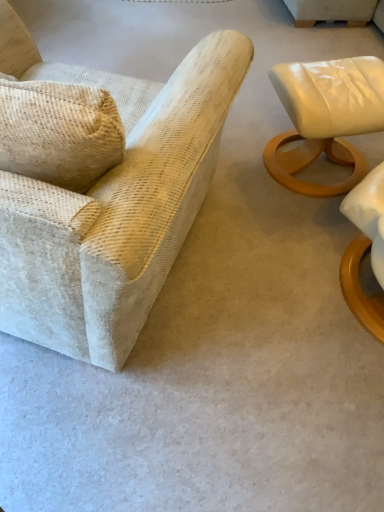
The height and width of the screenshot is (512, 384). What do you see at coordinates (325, 118) in the screenshot?
I see `matte white leather ottoman at right, the second chair viewed from the left` at bounding box center [325, 118].

Identify the location of matte white leather ottoman at right, positioned as the 1th chair in right-to-left order. (325, 118).

Find the location of a particular element. The image size is (384, 512). textured beige armchair at left, which appears as the second chair when viewed from the right is located at coordinates (112, 203).

What do you see at coordinates (112, 203) in the screenshot?
I see `textured beige armchair at left, arranged as the 1th chair when viewed from the left` at bounding box center [112, 203].

Where is `matte white leather ottoman at right, the second chair viewed from the left`? The height and width of the screenshot is (512, 384). matte white leather ottoman at right, the second chair viewed from the left is located at coordinates (325, 118).

Between matte white leather ottoman at right, the second chair viewed from the left, and textured beige armchair at left, which appears as the second chair when viewed from the right, which one appears on the right side from the viewer's perspective?

matte white leather ottoman at right, the second chair viewed from the left.

Is matte white leather ottoman at right, positioned as the 1th chair in right-to-left order, positioned behind textured beige armchair at left, which appears as the second chair when viewed from the right?

Yes.

Considering the positions of point (290, 109) and point (164, 118), is point (290, 109) closer or farther from the camera than point (164, 118)?

Point (290, 109) is farther from the camera than point (164, 118).

Based on the photo, from the image's perspective, would you say matte white leather ottoman at right, the second chair viewed from the left, is positioned over textured beige armchair at left, arranged as the 1th chair when viewed from the left?

Correct, matte white leather ottoman at right, the second chair viewed from the left, appears higher than textured beige armchair at left, arranged as the 1th chair when viewed from the left, in the image.

Looking at this image, from a real-world perspective, between matte white leather ottoman at right, the second chair viewed from the left, and textured beige armchair at left, which appears as the second chair when viewed from the right, who is vertically lower?

In real-world perspective, matte white leather ottoman at right, the second chair viewed from the left, is lower.

Between matte white leather ottoman at right, the second chair viewed from the left, and textured beige armchair at left, arranged as the 1th chair when viewed from the left, which one has smaller width?

matte white leather ottoman at right, the second chair viewed from the left.

Who is taller, matte white leather ottoman at right, positioned as the 1th chair in right-to-left order, or textured beige armchair at left, which appears as the second chair when viewed from the right?

textured beige armchair at left, which appears as the second chair when viewed from the right.

Between matte white leather ottoman at right, positioned as the 1th chair in right-to-left order, and textured beige armchair at left, which appears as the second chair when viewed from the right, which one has larger size?

With larger size is textured beige armchair at left, which appears as the second chair when viewed from the right.

Looking at this image, would you say matte white leather ottoman at right, positioned as the 1th chair in right-to-left order, is inside or outside textured beige armchair at left, arranged as the 1th chair when viewed from the left?

matte white leather ottoman at right, positioned as the 1th chair in right-to-left order, is located beyond the bounds of textured beige armchair at left, arranged as the 1th chair when viewed from the left.

Is matte white leather ottoman at right, the second chair viewed from the left, placed right next to textured beige armchair at left, which appears as the second chair when viewed from the right?

They are not placed beside each other.

Based on the photo, is matte white leather ottoman at right, positioned as the 1th chair in right-to-left order, facing towards textured beige armchair at left, which appears as the second chair when viewed from the right?

No.

How distant is matte white leather ottoman at right, the second chair viewed from the left, from textured beige armchair at left, arranged as the 1th chair when viewed from the left?

A distance of 29.43 inches exists between matte white leather ottoman at right, the second chair viewed from the left, and textured beige armchair at left, arranged as the 1th chair when viewed from the left.

The image size is (384, 512). I want to click on chair on the right of textured beige armchair at left, which appears as the second chair when viewed from the right, so click(x=325, y=118).

In the scene shown: Which object is positioned more to the left, textured beige armchair at left, which appears as the second chair when viewed from the right, or matte white leather ottoman at right, positioned as the 1th chair in right-to-left order?

From the viewer's perspective, textured beige armchair at left, which appears as the second chair when viewed from the right, appears more on the left side.

Looking at this image, considering the positions of objects textured beige armchair at left, which appears as the second chair when viewed from the right, and matte white leather ottoman at right, the second chair viewed from the left, in the image provided, who is in front, textured beige armchair at left, which appears as the second chair when viewed from the right, or matte white leather ottoman at right, the second chair viewed from the left,?

textured beige armchair at left, which appears as the second chair when viewed from the right, is closer to the camera.

Is point (88, 218) positioned before point (351, 66)?

That is True.

From the image's perspective, which is below, textured beige armchair at left, which appears as the second chair when viewed from the right, or matte white leather ottoman at right, the second chair viewed from the left?

From the image's view, textured beige armchair at left, which appears as the second chair when viewed from the right, is below.

From a real-world perspective, who is located higher, textured beige armchair at left, which appears as the second chair when viewed from the right, or matte white leather ottoman at right, the second chair viewed from the left?

textured beige armchair at left, which appears as the second chair when viewed from the right, from a real-world perspective.

Can you confirm if textured beige armchair at left, which appears as the second chair when viewed from the right, is wider than matte white leather ottoman at right, the second chair viewed from the left?

Indeed, textured beige armchair at left, which appears as the second chair when viewed from the right, has a greater width compared to matte white leather ottoman at right, the second chair viewed from the left.

Is textured beige armchair at left, arranged as the 1th chair when viewed from the left, taller than matte white leather ottoman at right, positioned as the 1th chair in right-to-left order?

Indeed, textured beige armchair at left, arranged as the 1th chair when viewed from the left, has a greater height compared to matte white leather ottoman at right, positioned as the 1th chair in right-to-left order.

Considering the sizes of objects textured beige armchair at left, arranged as the 1th chair when viewed from the left, and matte white leather ottoman at right, the second chair viewed from the left, in the image provided, who is bigger, textured beige armchair at left, arranged as the 1th chair when viewed from the left, or matte white leather ottoman at right, the second chair viewed from the left,?

With larger size is textured beige armchair at left, arranged as the 1th chair when viewed from the left.

Can we say textured beige armchair at left, arranged as the 1th chair when viewed from the left, lies outside matte white leather ottoman at right, positioned as the 1th chair in right-to-left order?

Yes, textured beige armchair at left, arranged as the 1th chair when viewed from the left, is not within matte white leather ottoman at right, positioned as the 1th chair in right-to-left order.

Is textured beige armchair at left, arranged as the 1th chair when viewed from the left, not close to matte white leather ottoman at right, positioned as the 1th chair in right-to-left order?

No.

Is textured beige armchair at left, which appears as the second chair when viewed from the right, facing towards matte white leather ottoman at right, the second chair viewed from the left?

No, textured beige armchair at left, which appears as the second chair when viewed from the right, is not facing towards matte white leather ottoman at right, the second chair viewed from the left.

Measure the distance from textured beige armchair at left, which appears as the second chair when viewed from the right, to matte white leather ottoman at right, positioned as the 1th chair in right-to-left order.

29.43 inches.

This screenshot has height=512, width=384. What are the coordinates of `chair lying on the left of matte white leather ottoman at right, positioned as the 1th chair in right-to-left order` in the screenshot? It's located at (112, 203).

This screenshot has height=512, width=384. There is a matte white leather ottoman at right, the second chair viewed from the left. What are the coordinates of `chair above it (from a real-world perspective)` in the screenshot? It's located at (112, 203).

Identify the location of chair that appears below the textured beige armchair at left, which appears as the second chair when viewed from the right (from a real-world perspective). The width and height of the screenshot is (384, 512). (325, 118).